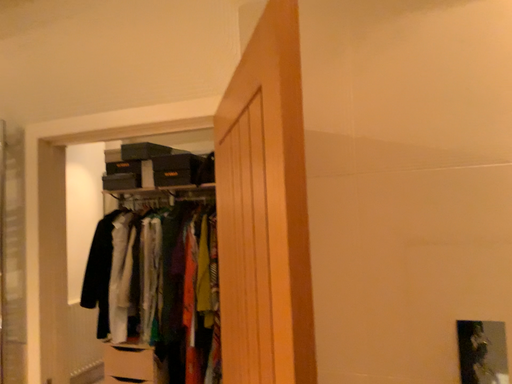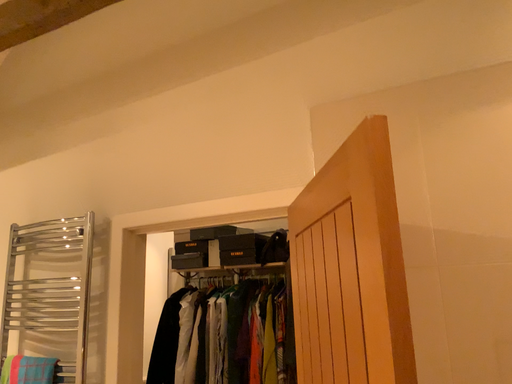
Question: Which way did the camera rotate in the video?

Choices:
 (A) rotated right
 (B) rotated left

Answer: (B)